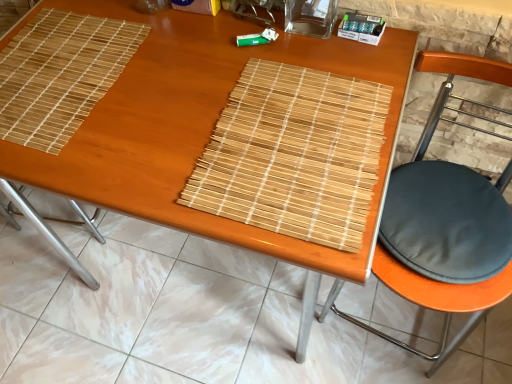
The image size is (512, 384). I want to click on blank space above natural bamboo mat at center, which ranks as the first mat in right-to-left order (from a real-world perspective), so click(293, 136).